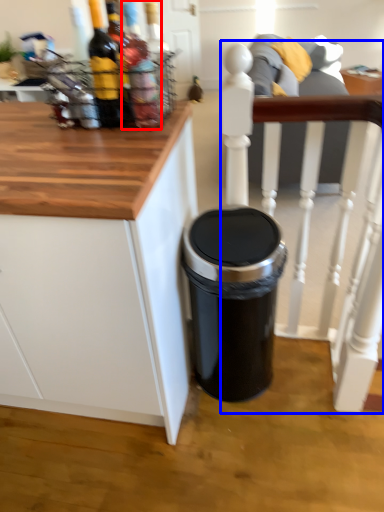
Question: Which of the following is the closest to the observer, bottle (highlighted by a red box) or chair (highlighted by a blue box)?

Choices:
 (A) bottle
 (B) chair

Answer: (A)